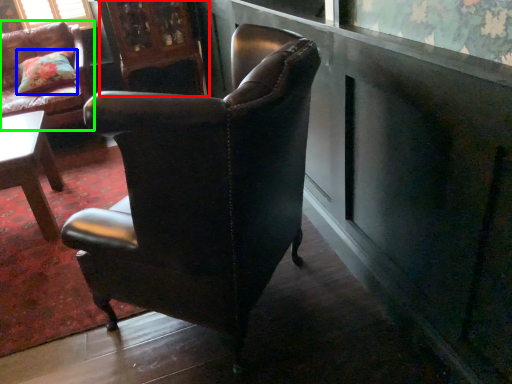
Question: Estimate the real-world distances between objects in this image. Which object is closer to armoire (highlighted by a red box), pillow (highlighted by a blue box) or chair (highlighted by a green box)?

Choices:
 (A) pillow
 (B) chair

Answer: (B)